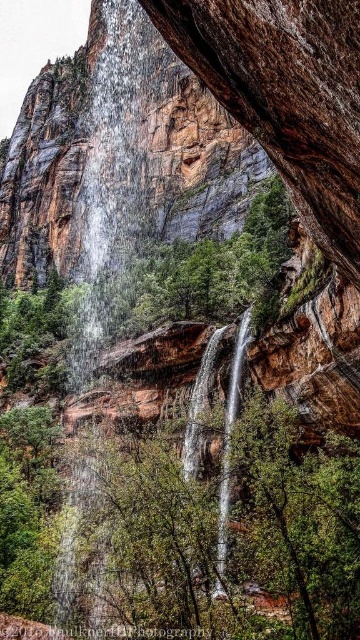
Does translucent glass waterfall at left appear over clear glass waterfall at center?

Correct, translucent glass waterfall at left is located above clear glass waterfall at center.

Which of these two, translucent glass waterfall at left or clear glass waterfall at center, stands taller?

translucent glass waterfall at left

I want to click on translucent glass waterfall at left, so click(110, 170).

You are a GUI agent. You are given a task and a screenshot of the screen. Output one action in this format:
    pyautogui.click(x=<x>, y=<y>)
    Task: Click on the translucent glass waterfall at left
    
    Given the screenshot: What is the action you would take?
    pyautogui.click(x=110, y=170)